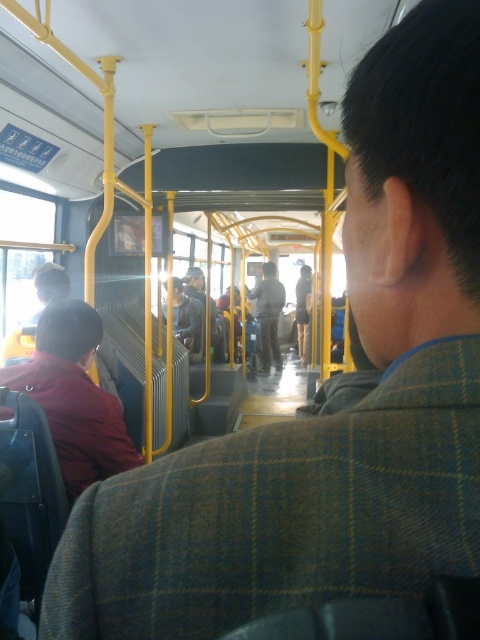
You are standing at the back of the bus and want to reach the front door. There is a point at coordinates (267, 314) in the image where a dark gray fabric jacket is located. Is there enough space between you and the dark gray fabric jacket at center to move forward?

The point at (267, 314) has the dark gray fabric jacket at center. Since the aisle is narrow, you should check the distance. However, without specific measurements, it is uncertain if there is enough space to move forward safely.

Based on the photo, you are a passenger on a public bus and need to retrieve your bag from the overhead compartment. You see a dark gray fabric jacket at center and a dark gray leather jacket at center. Which jacket is closer to you?

The dark gray fabric jacket at center is positioned under the dark gray leather jacket at center, so the dark gray fabric jacket at center is closer to you.

You are a passenger on the bus and need to reach the front door, which is located at the very front of the bus. You notice two people sitting in the aisleside seats. One is wearing a maroon fabric jacket at left and the other is wearing a dark gray fabric jacket at center. Which jacket is smaller in size?

The maroon fabric jacket at left is smaller than the dark gray fabric jacket at center, so the maroon fabric jacket at left is the smaller one.